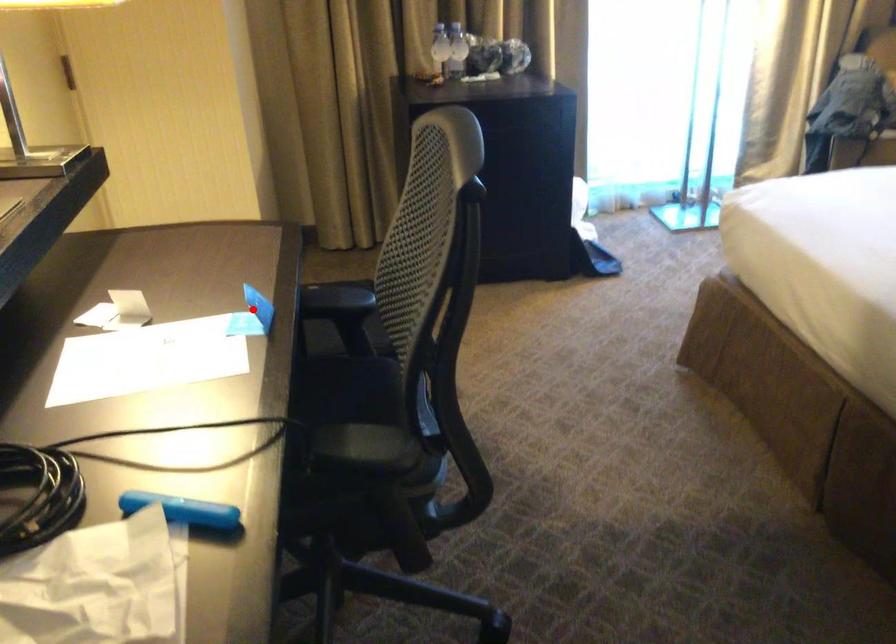
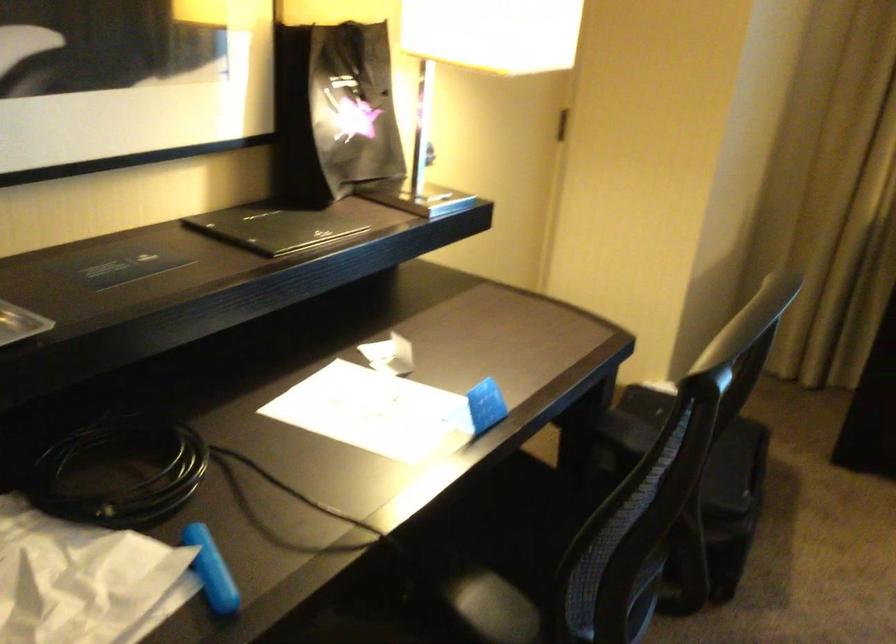
Where in the second image is the point corresponding to the highlighted location from the first image?

(479, 408)